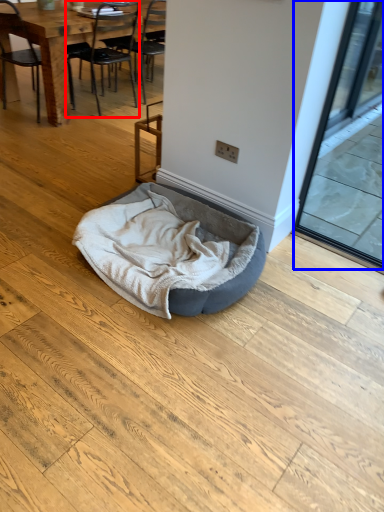
Question: Which of the following is the closest to the observer, chair (highlighted by a red box) or screen door (highlighted by a blue box)?

Choices:
 (A) chair
 (B) screen door

Answer: (B)